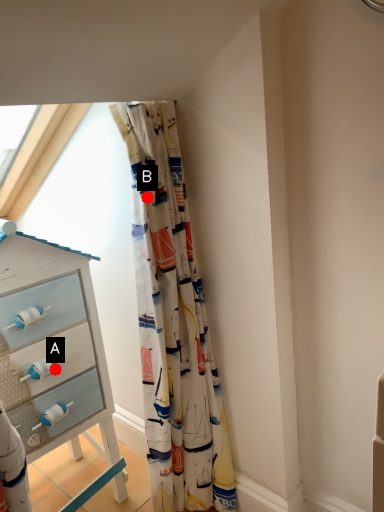
Question: Two points are circled on the image, labeled by A and B beside each circle. Among these points, which one is nearest to the camera?

Choices:
 (A) A is closer
 (B) B is closer

Answer: (B)